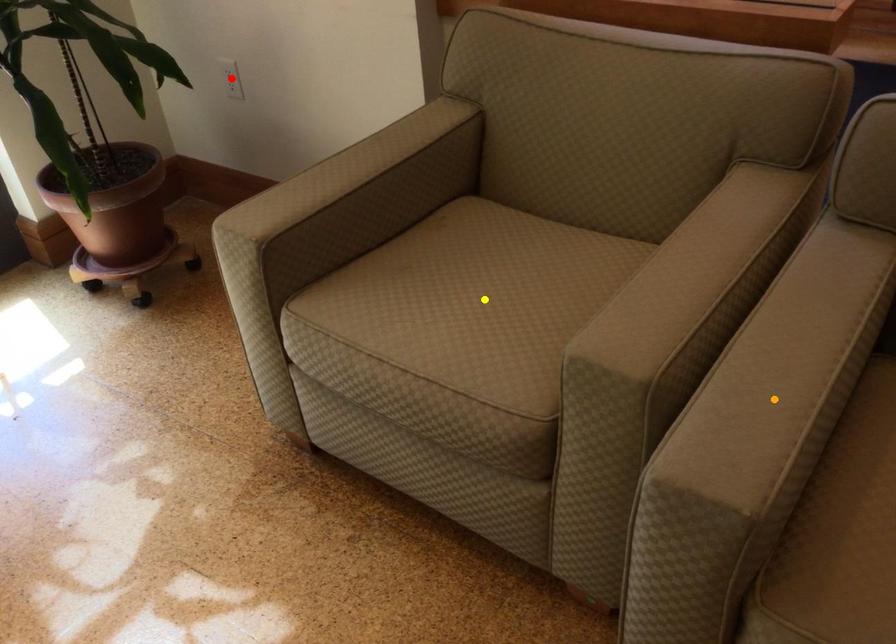
Order these from nearest to farthest:
red point | yellow point | orange point

1. orange point
2. yellow point
3. red point